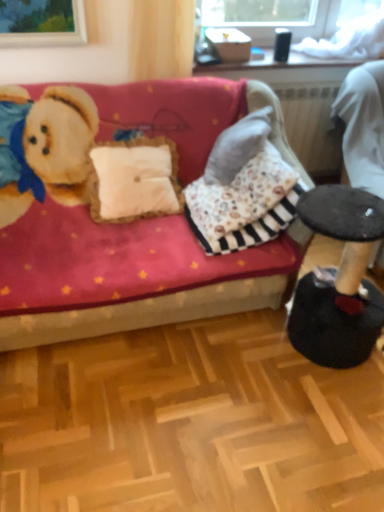
Locate an element on the screen. The height and width of the screenshot is (512, 384). vacant area that is in front of velvet red couch at center is located at coordinates (175, 417).